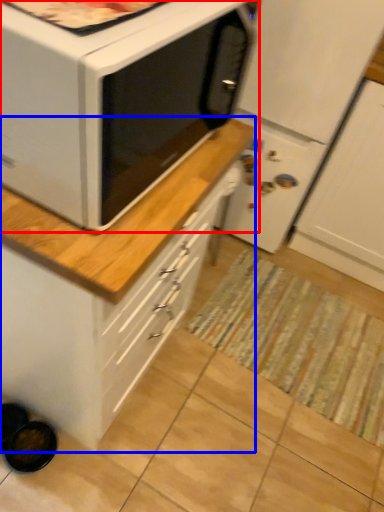
Question: Which object appears farthest to the camera in this image, microwave oven (highlighted by a red box) or cabinetry (highlighted by a blue box)?

Choices:
 (A) microwave oven
 (B) cabinetry

Answer: (B)